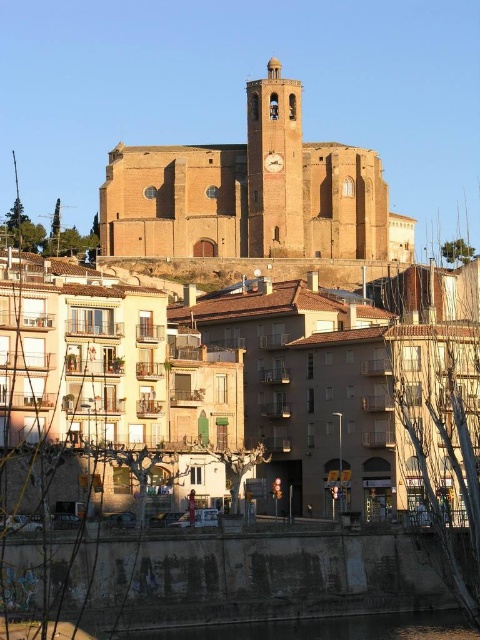
Question: Does brown stone clock tower at upper center appear on the right side of black concrete river at lower center?

Choices:
 (A) yes
 (B) no

Answer: (A)

Question: Which object is positioned farthest from the black concrete river at lower center?

Choices:
 (A) smooth stone clock tower at center
 (B) brown stone clock tower at upper center

Answer: (B)

Question: Can you confirm if smooth stone clock tower at center is positioned to the right of black concrete river at lower center?

Choices:
 (A) no
 (B) yes

Answer: (A)

Question: Which point is farther from the camera taking this photo?

Choices:
 (A) (298, 202)
 (B) (302, 205)
 (C) (159, 637)

Answer: (B)

Question: Which object appears farthest from the camera in this image?

Choices:
 (A) smooth stone clock tower at center
 (B) black concrete river at lower center
 (C) brown stone clock tower at upper center

Answer: (A)

Question: Does brown stone clock tower at upper center have a larger size compared to smooth stone clock tower at center?

Choices:
 (A) no
 (B) yes

Answer: (B)